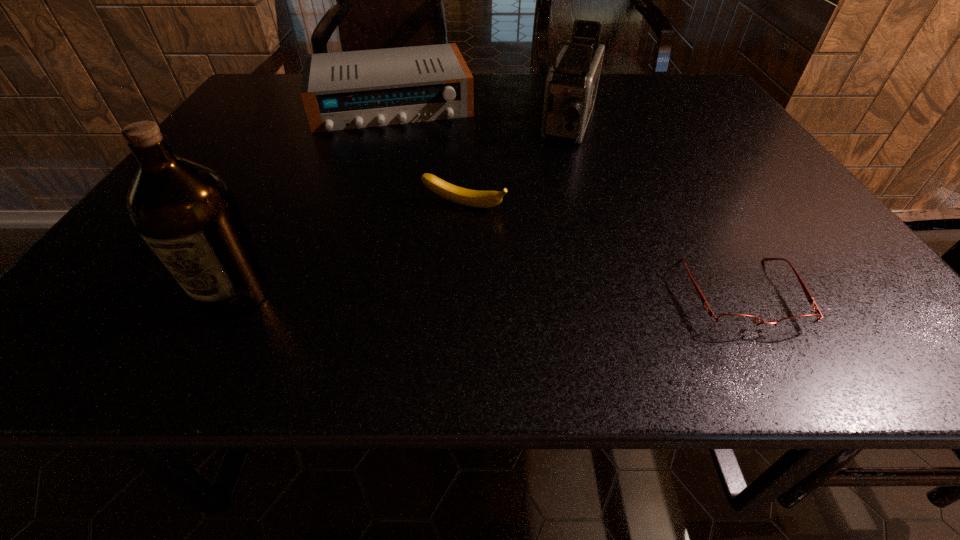
Identify the location of the tallest object. The height and width of the screenshot is (540, 960). (188, 215).

Identify the location of the shortest object. (736, 322).

Locate an element on the screen. The height and width of the screenshot is (540, 960). spectacles is located at coordinates (736, 322).

Where is `the fourth object from left to right`? the fourth object from left to right is located at coordinates (571, 86).

The width and height of the screenshot is (960, 540). Find the location of `the second tallest object`. the second tallest object is located at coordinates (571, 86).

What are the coordinates of `the third tallest object` in the screenshot? It's located at (355, 89).

Image resolution: width=960 pixels, height=540 pixels. Identify the location of the third nearest object. (474, 198).

Find the location of a particular element. This screenshot has height=540, width=960. the second shortest object is located at coordinates (474, 198).

The height and width of the screenshot is (540, 960). In order to click on vacant space located 0.250m at the lens of the second tallest object in this screenshot , I will do `click(544, 219)`.

At what (x,y) coordinates should I click in order to perform the action: click on free space located at the lens of the second tallest object. Please return your answer as a coordinate pair (x, y). The height and width of the screenshot is (540, 960). Looking at the image, I should click on (530, 256).